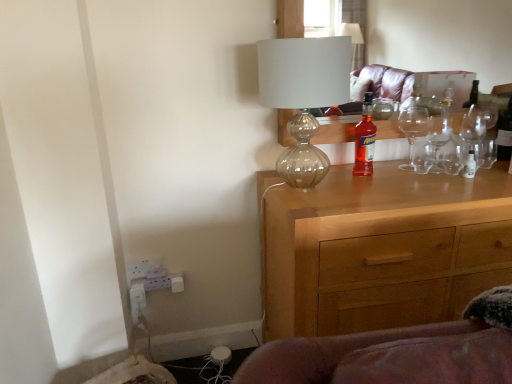
Question: From the image's perspective, is clear glass bottle at upper right, placed as the 2th bottle when sorted from left to right, positioned above or below transparent glass lampshade at upper center?

Choices:
 (A) above
 (B) below

Answer: (A)

Question: Is clear glass bottle at upper right, which is the second bottle from front to back, wider or thinner than transparent glass lampshade at upper center?

Choices:
 (A) thin
 (B) wide

Answer: (A)

Question: Estimate the real-world distances between objects in this image. Which object is farther from the wooden chest of drawers at center?

Choices:
 (A) translucent glass bottle at center, the 2th bottle positioned from the back
 (B) transparent glass lampshade at upper center
 (C) clear glass bottle at upper right, placed as the 2th bottle when sorted from left to right

Answer: (C)

Question: Based on their relative distances, which object is nearer to the wooden chest of drawers at center?

Choices:
 (A) transparent glass lampshade at upper center
 (B) translucent glass bottle at center, placed as the 2th bottle when sorted from right to left
 (C) clear glass bottle at upper right, the first bottle viewed from the right

Answer: (B)